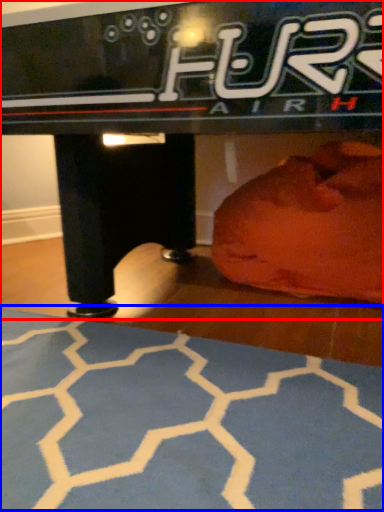
Question: Which object is closer to the camera taking this photo, table (highlighted by a red box) or yoga mat (highlighted by a blue box)?

Choices:
 (A) table
 (B) yoga mat

Answer: (B)